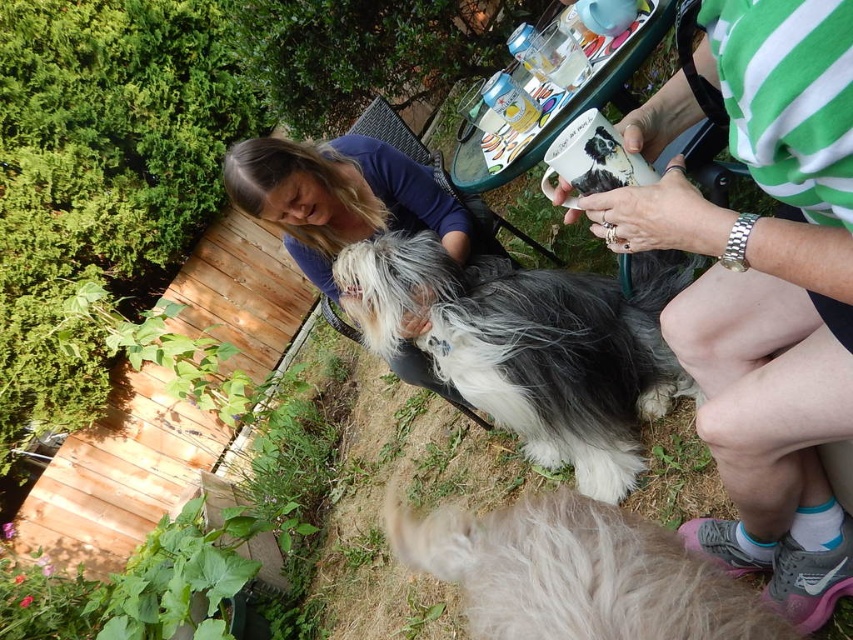
Question: Which point is farther to the camera?

Choices:
 (A) blue cotton shirt at center
 (B) fluffy white fur at lower center
 (C) fluffy gray-white fur at center
 (D) white ceramic mug at upper center

Answer: (A)

Question: Is the position of white ceramic mug at upper center more distant than that of fluffy gray-white fur at center?

Choices:
 (A) yes
 (B) no

Answer: (B)

Question: Which point appears closest to the camera in this image?

Choices:
 (A) (727, 72)
 (B) (579, 278)
 (C) (762, 621)
 (D) (241, 204)

Answer: (A)

Question: Which point is closer to the camera?

Choices:
 (A) (689, 392)
 (B) (648, 570)
 (C) (672, 188)

Answer: (B)

Question: Is white ceramic mug at upper center above blue cotton shirt at center?

Choices:
 (A) yes
 (B) no

Answer: (B)

Question: Considering the relative positions of white ceramic mug at upper center and blue cotton shirt at center in the image provided, where is white ceramic mug at upper center located with respect to blue cotton shirt at center?

Choices:
 (A) below
 (B) above

Answer: (A)